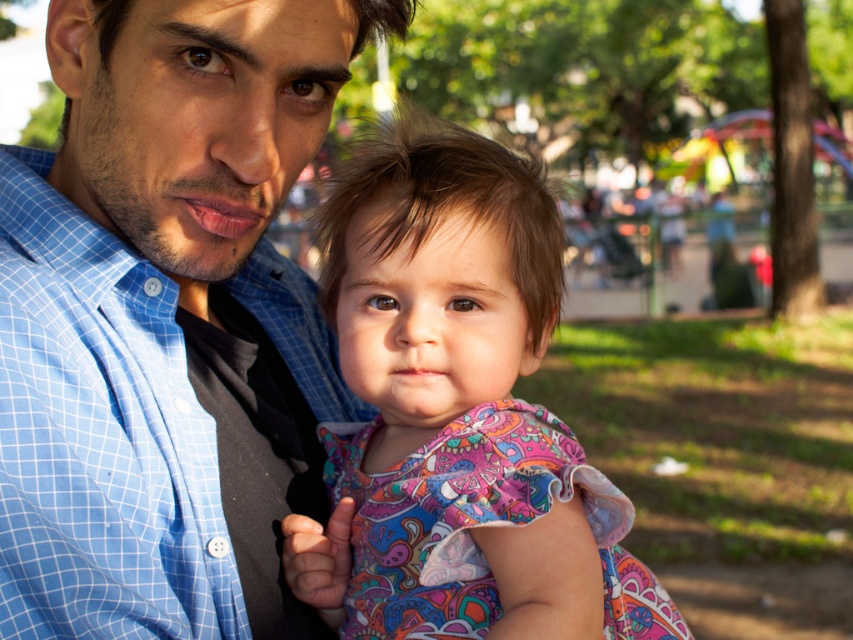
Question: Is paisley fabric dress at center smaller than blue checkered shirt at left?

Choices:
 (A) yes
 (B) no

Answer: (B)

Question: Can you confirm if blue checkered shirt at center is smaller than blue checkered shirt at left?

Choices:
 (A) yes
 (B) no

Answer: (B)

Question: Which point is closer to the camera taking this photo?

Choices:
 (A) (171, 547)
 (B) (108, 323)
 (C) (468, 312)

Answer: (A)

Question: Among these objects, which one is farthest from the camera?

Choices:
 (A) blue checkered shirt at center
 (B) blue checkered shirt at left

Answer: (B)

Question: Which point is closer to the camera?

Choices:
 (A) paisley fabric dress at center
 (B) blue checkered shirt at left
 (C) blue checkered shirt at center

Answer: (C)

Question: Is blue checkered shirt at center further to camera compared to blue checkered shirt at left?

Choices:
 (A) no
 (B) yes

Answer: (A)